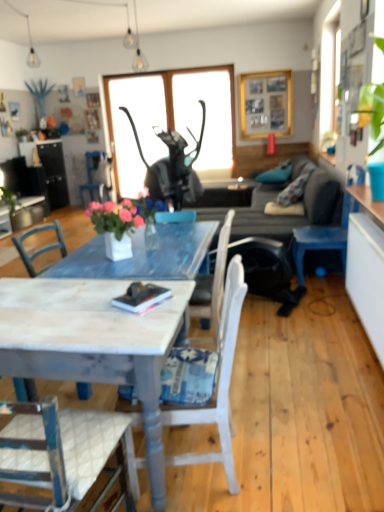
Question: Should I look upward or downward to see white painted wood desk at center?

Choices:
 (A) up
 (B) down

Answer: (B)

Question: Is white painted wood chair at center, which appears as the first chair when ordered from the bottom, closer to camera compared to white painted wood desk at center?

Choices:
 (A) yes
 (B) no

Answer: (B)

Question: Does white painted wood chair at center, acting as the second chair starting from the right, lie behind white painted wood desk at center?

Choices:
 (A) yes
 (B) no

Answer: (A)

Question: Is white painted wood chair at center, positioned as the second chair in left-to-right order, next to white painted wood desk at center and touching it?

Choices:
 (A) yes
 (B) no

Answer: (B)

Question: From the image's perspective, is white painted wood chair at center, acting as the second chair starting from the right, above white painted wood desk at center?

Choices:
 (A) no
 (B) yes

Answer: (B)

Question: From the image's perspective, is white painted wood chair at center, which appears as the first chair when ordered from the bottom, under white painted wood desk at center?

Choices:
 (A) no
 (B) yes

Answer: (A)

Question: Is white painted wood chair at center, arranged as the first chair when viewed from the front, completely or partially outside of white painted wood desk at center?

Choices:
 (A) yes
 (B) no

Answer: (B)

Question: From the image's perspective, is white glossy vase at center below dark gray fabric couch at center?

Choices:
 (A) no
 (B) yes

Answer: (B)

Question: Can you confirm if white glossy vase at center is wider than dark gray fabric couch at center?

Choices:
 (A) no
 (B) yes

Answer: (A)

Question: Is dark gray fabric couch at center surrounded by white glossy vase at center?

Choices:
 (A) yes
 (B) no

Answer: (B)

Question: From the image's perspective, is white glossy vase at center above dark gray fabric couch at center?

Choices:
 (A) no
 (B) yes

Answer: (A)

Question: Is white glossy vase at center turned away from dark gray fabric couch at center?

Choices:
 (A) yes
 (B) no

Answer: (B)

Question: Are white glossy vase at center and dark gray fabric couch at center making contact?

Choices:
 (A) yes
 (B) no

Answer: (B)

Question: Is metallic black cat statue at upper center, the second window screen viewed from the right, surrounded by blue painted wood chair at center, which appears as the third chair when viewed from the front?

Choices:
 (A) no
 (B) yes

Answer: (A)